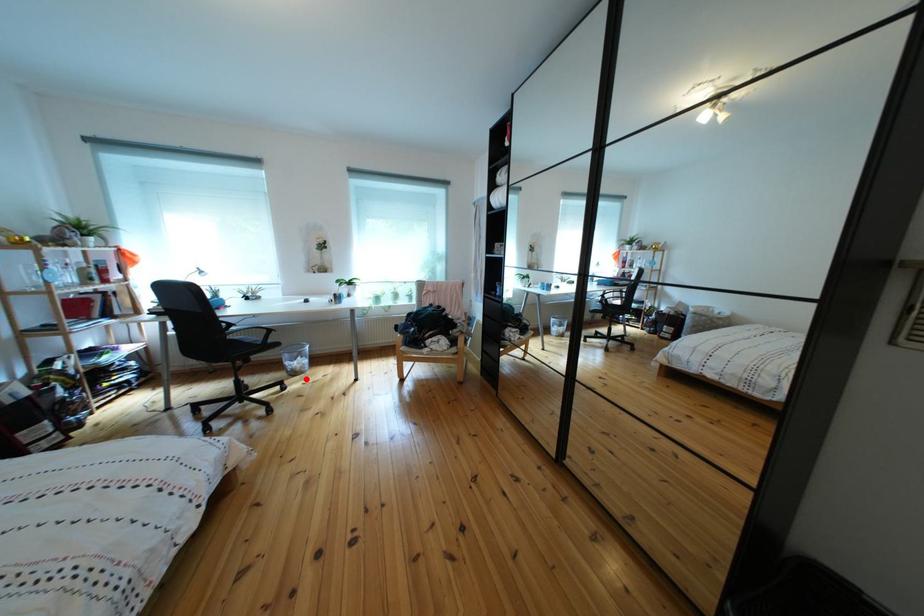
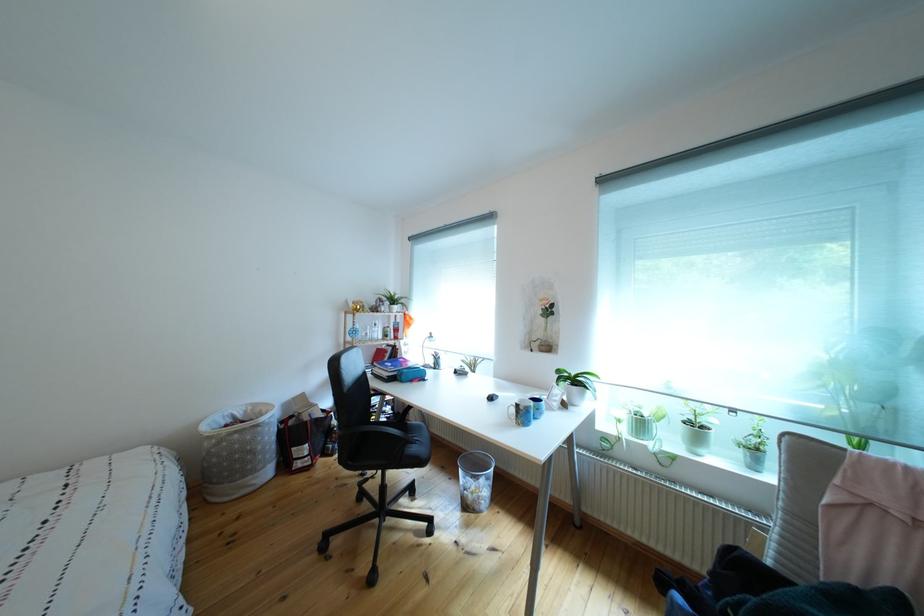
Where in the second image is the point corresponding to the highlighted location from the first image?

(477, 512)